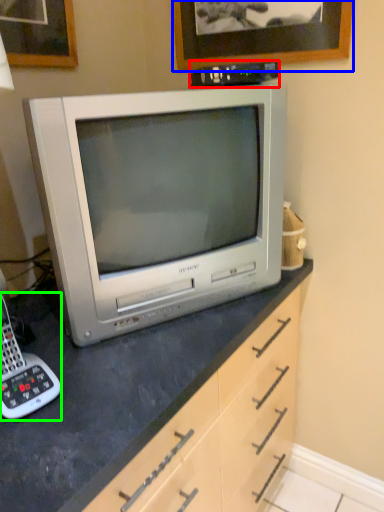
Question: Considering the real-world distances, which object is farthest from appliance (highlighted by a red box)? picture frame (highlighted by a blue box) or corded phone (highlighted by a green box)?

Choices:
 (A) picture frame
 (B) corded phone

Answer: (B)